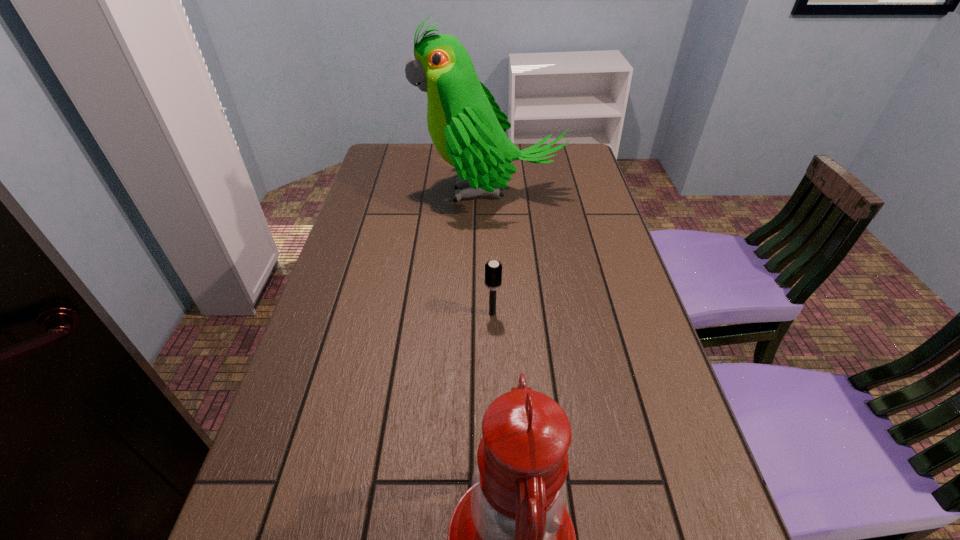
Identify the location of parakeet. This screenshot has width=960, height=540. (467, 127).

Locate an element on the screen. the tallest object is located at coordinates (467, 127).

Image resolution: width=960 pixels, height=540 pixels. In order to click on hairbrush in this screenshot , I will do `click(493, 270)`.

This screenshot has width=960, height=540. Find the location of `the shortest object`. the shortest object is located at coordinates (493, 270).

Identify the location of vacant area situated 0.130m on the beak of the parakeet. This screenshot has height=540, width=960. (379, 193).

Identify the location of vacant space positioned on the beak of the parakeet. The image size is (960, 540). (375, 193).

Where is `free space located 0.150m on the back of the hairbrush`? The height and width of the screenshot is (540, 960). free space located 0.150m on the back of the hairbrush is located at coordinates (491, 267).

Identify the location of object positioned at the far edge. Image resolution: width=960 pixels, height=540 pixels. (467, 127).

The height and width of the screenshot is (540, 960). Identify the location of object located at the right edge. (467, 127).

Locate an element on the screen. object located at the far right corner is located at coordinates [467, 127].